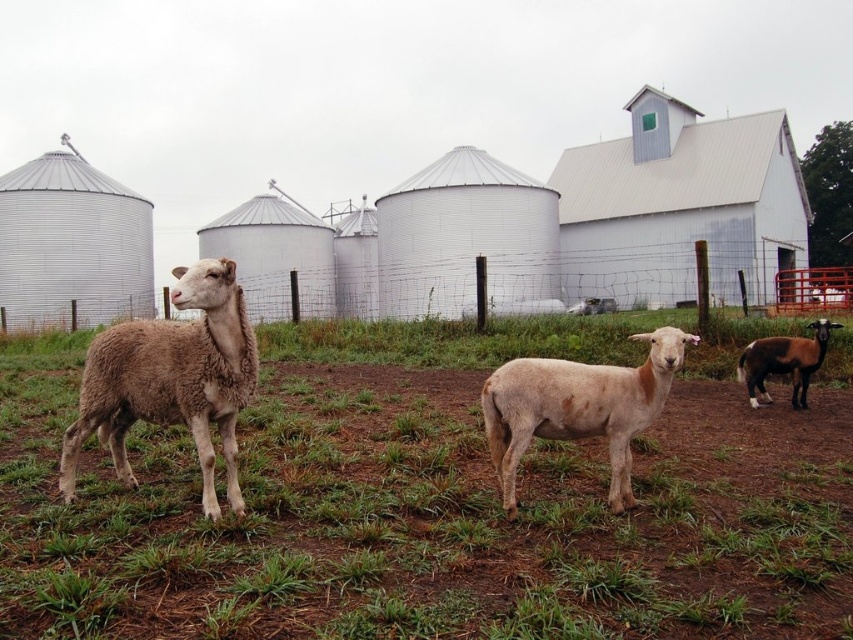
Does green grass at center have a larger size compared to brown glossy goat at right?

Indeed, green grass at center has a larger size compared to brown glossy goat at right.

Is green grass at center above brown glossy goat at right?

Actually, green grass at center is below brown glossy goat at right.

Who is more distant from viewer, (328, 406) or (753, 340)?

Positioned behind is point (753, 340).

You are a GUI agent. You are given a task and a screenshot of the screen. Output one action in this format:
    pyautogui.click(x=<x>, y=<y>)
    Task: Click on the green grass at center
    
    Given the screenshot: What is the action you would take?
    pyautogui.click(x=424, y=508)

Which of these two, white metal barn at upper right or brown glossy goat at right, stands shorter?

brown glossy goat at right is shorter.

Is white metal barn at upper right bigger than brown glossy goat at right?

Indeed, white metal barn at upper right has a larger size compared to brown glossy goat at right.

Find the location of `white metal barn at upper right`. white metal barn at upper right is located at coordinates (680, 205).

Can you confirm if light brown woolly sheep at left is positioned below fuzzy white sheep at center?

Indeed, light brown woolly sheep at left is positioned under fuzzy white sheep at center.

Is light brown woolly sheep at left smaller than fuzzy white sheep at center?

Incorrect, light brown woolly sheep at left is not smaller in size than fuzzy white sheep at center.

Which is in front, point (248, 326) or point (614, 451)?

Point (248, 326) is in front.

You are a GUI agent. You are given a task and a screenshot of the screen. Output one action in this format:
    pyautogui.click(x=<x>, y=<y>)
    Task: Click on the light brown woolly sheep at left
    
    Given the screenshot: What is the action you would take?
    pyautogui.click(x=171, y=380)